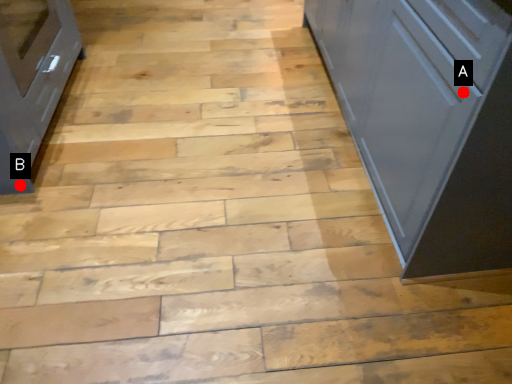
Question: Two points are circled on the image, labeled by A and B beside each circle. Which point appears farthest from the camera in this image?

Choices:
 (A) A is further
 (B) B is further

Answer: (B)